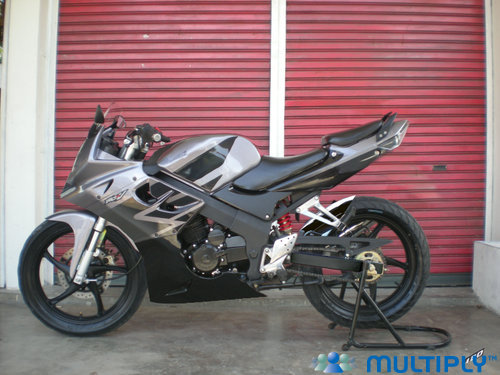
Where is `seat`? This screenshot has width=500, height=375. seat is located at coordinates (295, 175).